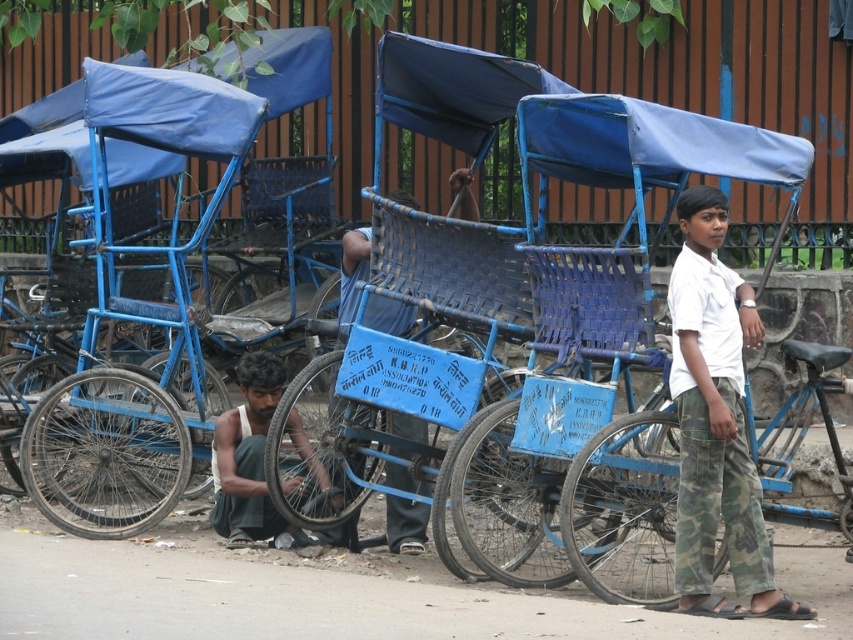
Question: Does white cotton shirt at center lie in front of dark blue fabric bicycle at lower left?

Choices:
 (A) no
 (B) yes

Answer: (B)

Question: Does white cotton shirt at center appear on the left side of dark blue fabric bicycle at lower left?

Choices:
 (A) yes
 (B) no

Answer: (B)

Question: Among these points, which one is nearest to the camera?

Choices:
 (A) (695, 611)
 (B) (288, 531)

Answer: (A)

Question: Among these points, which one is nearest to the camera?

Choices:
 (A) (250, 353)
 (B) (740, 500)

Answer: (B)

Question: Which object appears closest to the camera in this image?

Choices:
 (A) white cotton shirt at center
 (B) dark blue fabric bicycle at lower left

Answer: (A)

Question: Where is white cotton shirt at center located in relation to dark blue fabric bicycle at lower left in the image?

Choices:
 (A) right
 (B) left

Answer: (A)